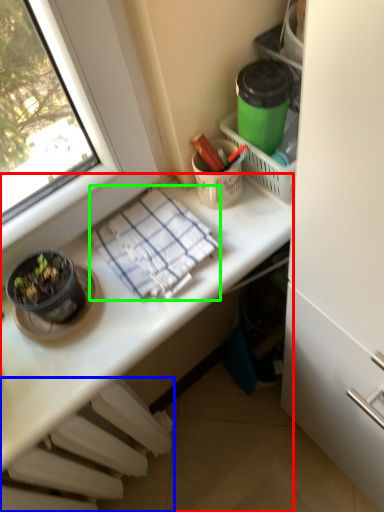
Question: Estimate the real-world distances between objects in this image. Which object is closer to desk (highlighted by a red box), radiator (highlighted by a blue box) or blanket (highlighted by a green box)?

Choices:
 (A) radiator
 (B) blanket

Answer: (B)